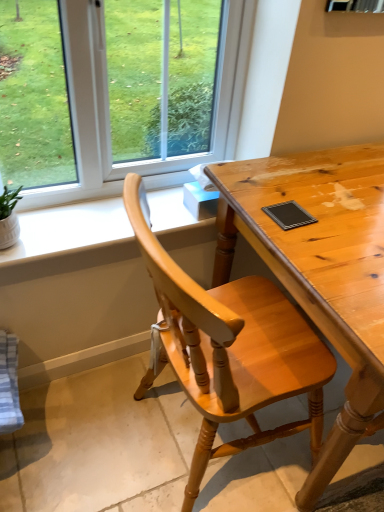
This screenshot has width=384, height=512. What do you see at coordinates (320, 268) in the screenshot? I see `light brown wooden desk at center` at bounding box center [320, 268].

You are a GUI agent. You are given a task and a screenshot of the screen. Output one action in this format:
    pyautogui.click(x=<x>, y=<y>)
    Task: Click on the white matte window sill at upper left
    The width and height of the screenshot is (384, 512).
    Given the screenshot: What is the action you would take?
    pyautogui.click(x=68, y=230)

I want to click on light brown wooden desk at center, so click(x=320, y=268).

Which object is positioned more to the left, white matte window sill at upper left or light brown wooden desk at center?

Positioned to the left is white matte window sill at upper left.

From the image's perspective, is white matte window sill at upper left over light brown wooden desk at center?

Yes, from the image's perspective, white matte window sill at upper left is above light brown wooden desk at center.

Could you tell me if white matte window sill at upper left is turned towards light brown wooden desk at center?

No.

From a real-world perspective, is white matte window sill at upper left beneath light brown wooden desk at center?

No, from a real-world perspective, white matte window sill at upper left is not below light brown wooden desk at center.

From the picture: Can you confirm if light brown wooden chair at center is positioned to the right of light brown wooden desk at center?

Incorrect, light brown wooden chair at center is not on the right side of light brown wooden desk at center.

Is light brown wooden chair at center taller or shorter than light brown wooden desk at center?

Clearly, light brown wooden chair at center is taller compared to light brown wooden desk at center.

Looking at this image, from a real-world perspective, is light brown wooden chair at center over light brown wooden desk at center?

Yes, from a real-world perspective, light brown wooden chair at center is above light brown wooden desk at center.

From the image's perspective, between light brown wooden chair at center and white matte window sill at upper left, which one is located above?

white matte window sill at upper left.

Would you say light brown wooden chair at center contains white matte window sill at upper left?

No, white matte window sill at upper left is not a part of light brown wooden chair at center.

Is light brown wooden chair at center with white matte window sill at upper left?

light brown wooden chair at center and white matte window sill at upper left are clearly separated.

Which is more to the right, white matte window sill at upper left or light brown wooden chair at center?

From the viewer's perspective, light brown wooden chair at center appears more on the right side.

From a real-world perspective, does white matte window sill at upper left sit lower than light brown wooden chair at center?

Actually, white matte window sill at upper left is physically above light brown wooden chair at center in the real world.

Considering the sizes of objects white matte window sill at upper left and light brown wooden chair at center in the image provided, who is smaller, white matte window sill at upper left or light brown wooden chair at center?

white matte window sill at upper left.

Which object is further away from the camera taking this photo, white matte window sill at upper left or light brown wooden chair at center?

white matte window sill at upper left.

From the image's perspective, which is above, light brown wooden desk at center or white matte window sill at upper left?

white matte window sill at upper left.

How far apart are light brown wooden desk at center and white matte window sill at upper left?

A distance of 16.12 inches exists between light brown wooden desk at center and white matte window sill at upper left.

Is light brown wooden desk at center located outside white matte window sill at upper left?

Indeed, light brown wooden desk at center is completely outside white matte window sill at upper left.

Between light brown wooden desk at center and white matte window sill at upper left, which one has smaller size?

Smaller between the two is white matte window sill at upper left.

Which object is closer to the camera, light brown wooden desk at center or light brown wooden chair at center?

light brown wooden chair at center is in front.

Considering the positions of points (342, 436) and (296, 361), is point (342, 436) farther from camera compared to point (296, 361)?

No, (342, 436) is closer to viewer.

Considering the relative sizes of light brown wooden desk at center and light brown wooden chair at center in the image provided, is light brown wooden desk at center smaller than light brown wooden chair at center?

Incorrect, light brown wooden desk at center is not smaller in size than light brown wooden chair at center.

Where is `desk below the white matte window sill at upper left (from the image's perspective)`? desk below the white matte window sill at upper left (from the image's perspective) is located at coordinates (320, 268).

Find the location of a particular element. Image resolution: width=384 pixels, height=512 pixels. desk on the right side of light brown wooden chair at center is located at coordinates (320, 268).

Which object lies nearer to the anchor point white matte window sill at upper left, light brown wooden chair at center or light brown wooden desk at center?

light brown wooden desk at center is positioned closer to the anchor white matte window sill at upper left.

Which object lies further to the anchor point light brown wooden chair at center, light brown wooden desk at center or white matte window sill at upper left?

white matte window sill at upper left is positioned further to the anchor light brown wooden chair at center.

Considering their positions, is light brown wooden chair at center positioned further to light brown wooden desk at center than white matte window sill at upper left?

white matte window sill at upper left.

Which object lies further to the anchor point light brown wooden chair at center, white matte window sill at upper left or light brown wooden desk at center?

white matte window sill at upper left.

In the scene shown: Looking at the image, which one is located further to light brown wooden desk at center, white matte window sill at upper left or light brown wooden chair at center?

Based on the image, white matte window sill at upper left appears to be further to light brown wooden desk at center.

Looking at the image, which one is located further to white matte window sill at upper left, light brown wooden desk at center or light brown wooden chair at center?

Among the two, light brown wooden chair at center is located further to white matte window sill at upper left.

In order to click on chair situated between white matte window sill at upper left and light brown wooden desk at center from left to right in this screenshot , I will do `click(228, 349)`.